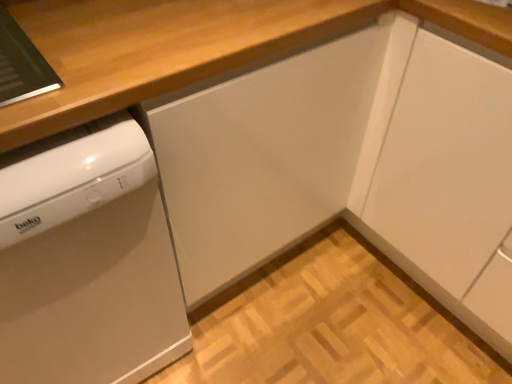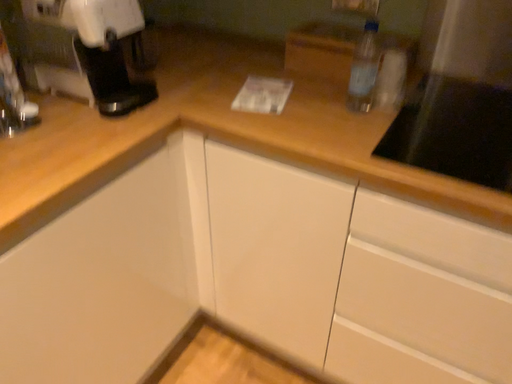
Question: How did the camera likely rotate when shooting the video?

Choices:
 (A) rotated left
 (B) rotated right

Answer: (B)